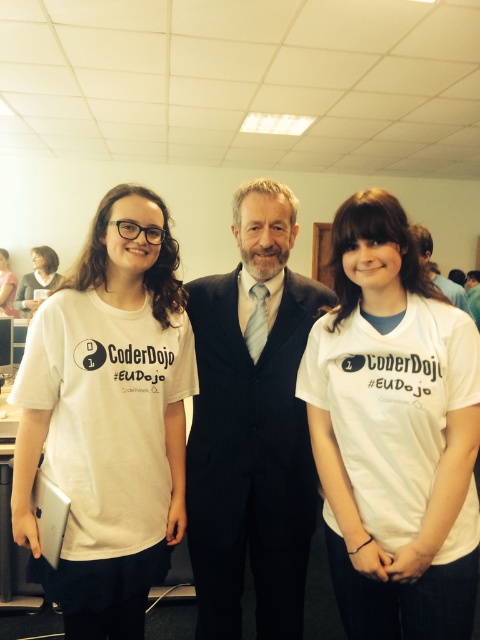
Question: Based on their relative distances, which object is nearer to the black pinstripe suit at center?

Choices:
 (A) white t-shirt at center
 (B) white cotton t-shirt at center

Answer: (B)

Question: Which of the following is the closest to the observer?

Choices:
 (A) black pinstripe suit at center
 (B) white t-shirt at center
 (C) matte white shirt at upper left

Answer: (A)

Question: Does white matte t-shirt at left lie behind black pinstripe suit at center?

Choices:
 (A) yes
 (B) no

Answer: (B)

Question: Which point is closer to the camera taking this photo?

Choices:
 (A) (8, 308)
 (B) (340, 403)
 (C) (45, 246)

Answer: (B)

Question: In this image, where is matte white shirt at upper left located relative to black suit at center?

Choices:
 (A) below
 (B) above

Answer: (A)

Question: Can you confirm if black pinstripe suit at center is positioned to the left of white t-shirt at center?

Choices:
 (A) no
 (B) yes

Answer: (A)